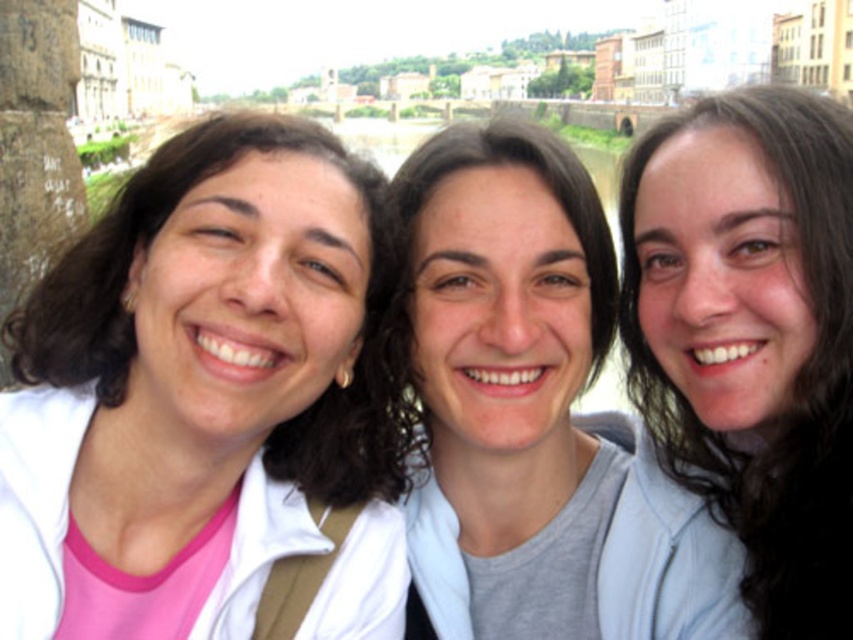
You are a photographer trying to capture a clear shot of the white matte jacket at left. Based on its 2D location coordinates, where should you aim your camera?

→ The white matte jacket at left is located at the 2D coordinates point (202, 400), so aim your camera at that specific point to capture it clearly.

You are taking a photo of three friends standing in front of a historic building. You want to ensure that the white matte jacket at left and the dark brown hair at center are both clearly visible in the frame. Based on their positions, which object should be placed closer to the left side of the camera frame?

The white matte jacket at left is to the left of the dark brown hair at center, so the white matte jacket at left should be placed closer to the left side of the camera frame.